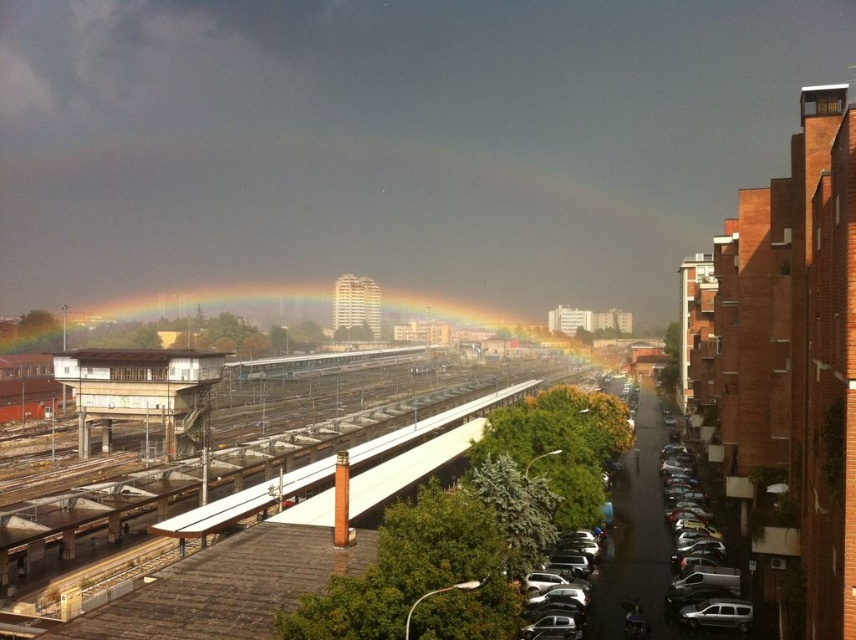
You are standing at the railway station and want to walk to the point marked as point (583, 634). There is an obstacle at point (117, 368). Will you be able to see the obstacle from your starting position?

Point (117, 368) is behind point (583, 634), so you will not be able to see the obstacle at point (117, 368) from your starting position because it is obscured by point (583, 634).